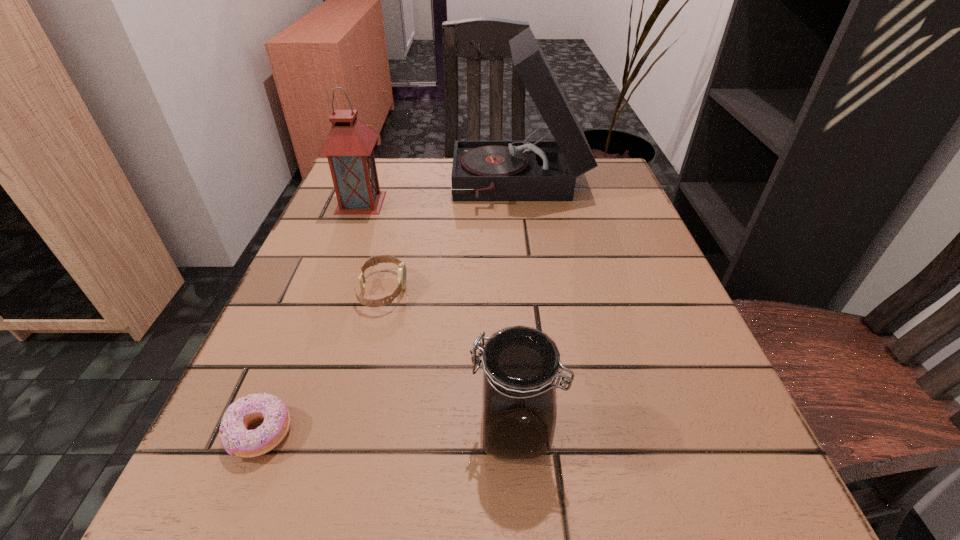
Locate an element on the screen. the tallest object is located at coordinates (525, 170).

At what (x,y) coordinates should I click in order to perform the action: click on the second tallest object. Please return your answer as a coordinate pair (x, y). Image resolution: width=960 pixels, height=540 pixels. Looking at the image, I should click on (349, 145).

This screenshot has width=960, height=540. I want to click on the third tallest object, so click(x=520, y=364).

Locate an element on the screen. The width and height of the screenshot is (960, 540). the third farthest object is located at coordinates (374, 260).

This screenshot has height=540, width=960. I want to click on watch, so click(374, 260).

Image resolution: width=960 pixels, height=540 pixels. Find the location of `doughnut`. doughnut is located at coordinates (236, 439).

Image resolution: width=960 pixels, height=540 pixels. Find the location of `blank space located 0.210m on the front-facing side of the phonograph_record`. blank space located 0.210m on the front-facing side of the phonograph_record is located at coordinates (366, 186).

The height and width of the screenshot is (540, 960). Find the location of `vacant space located 0.240m on the front-facing side of the phonograph_record`. vacant space located 0.240m on the front-facing side of the phonograph_record is located at coordinates (353, 186).

Where is `free spot located on the front-facing side of the phonograph_record`? This screenshot has width=960, height=540. free spot located on the front-facing side of the phonograph_record is located at coordinates (346, 186).

Identify the location of vacant space located 0.170m on the front of the second tallest object. (337, 265).